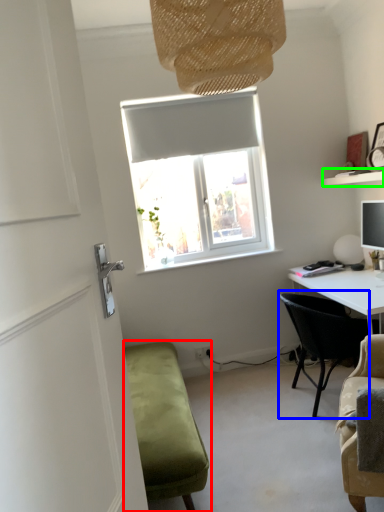
Question: Which object is the farthest from studio couch (highlighted by a red box)? Choose among these: chair (highlighted by a blue box) or shelf (highlighted by a green box).

Choices:
 (A) chair
 (B) shelf

Answer: (B)